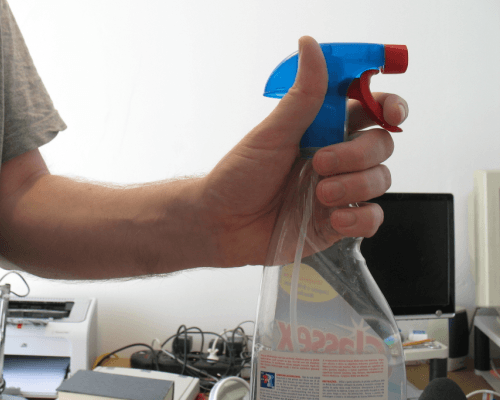
The width and height of the screenshot is (500, 400). What are the coordinates of `printer` in the screenshot? It's located at (65, 336).